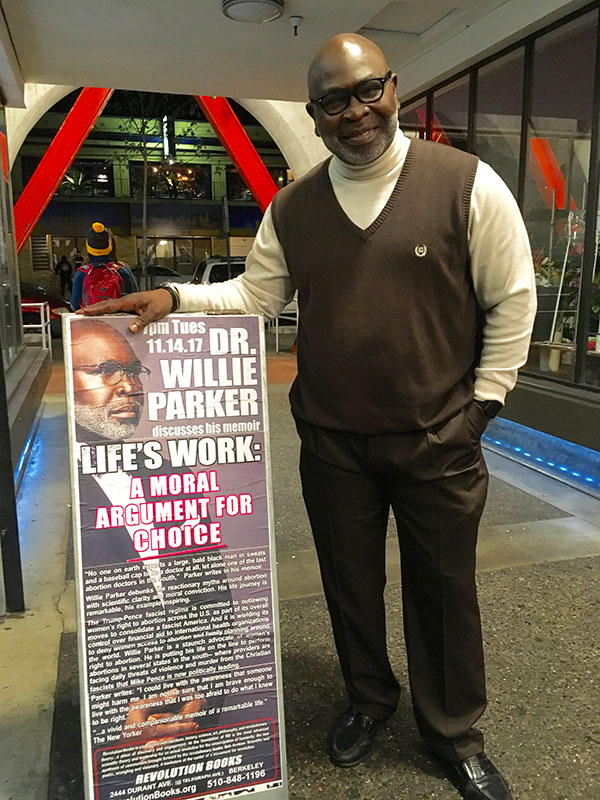
The width and height of the screenshot is (600, 800). What are the coordinates of `arched entryway` in the screenshot? It's located at (37, 100), (275, 122).